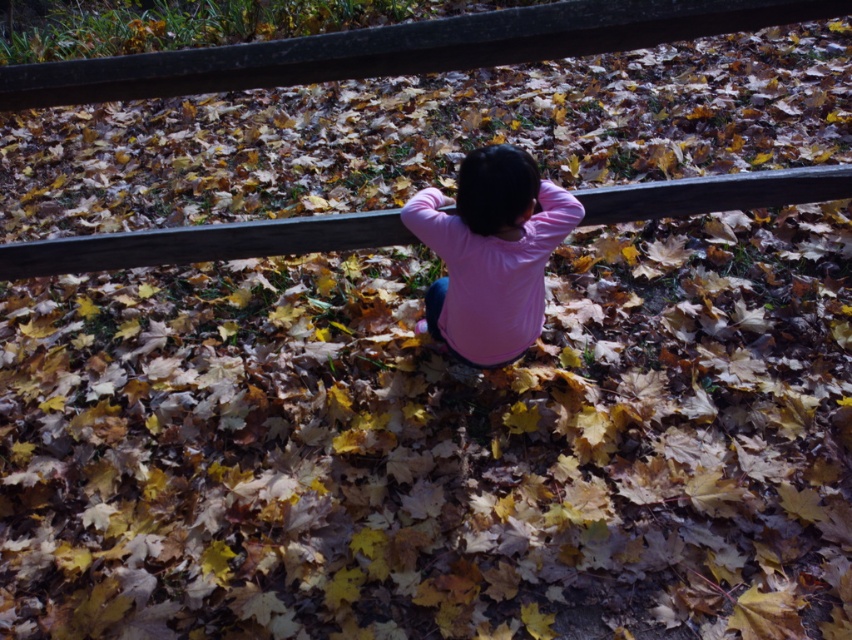
Is pink matte shirt at center closer to the viewer compared to wooden rail at center?

Yes, it is.

What do you see at coordinates (491, 253) in the screenshot? This screenshot has height=640, width=852. I see `pink matte shirt at center` at bounding box center [491, 253].

Where is `pink matte shirt at center`? Image resolution: width=852 pixels, height=640 pixels. pink matte shirt at center is located at coordinates (491, 253).